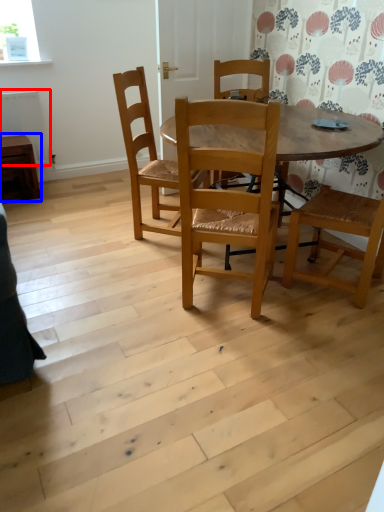
Question: Which object appears farthest to the camera in this image, radiator (highlighted by a red box) or table (highlighted by a blue box)?

Choices:
 (A) radiator
 (B) table

Answer: (A)